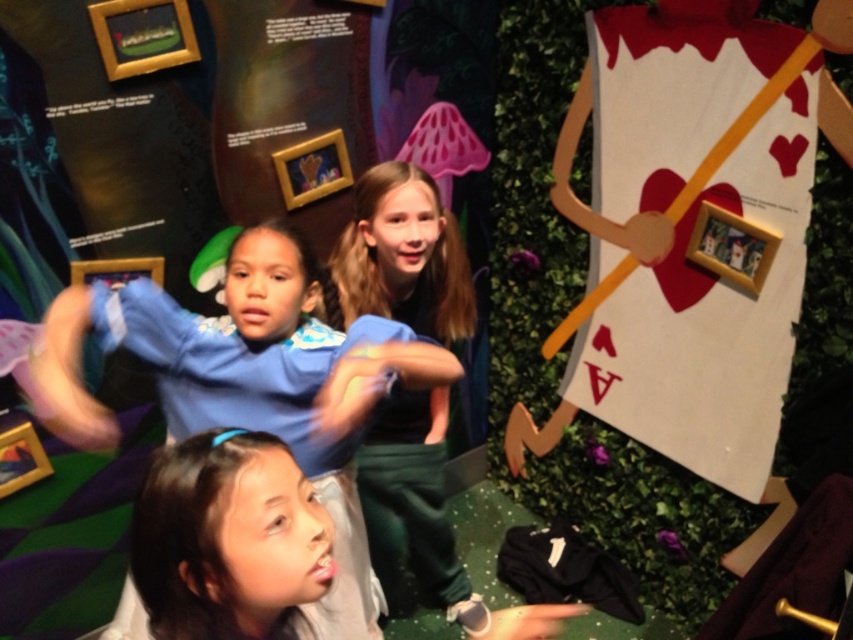
You are a child trying to reach the white cardboard heart at right from the blue fleece jacket at center. Can you stretch your arms to reach it without moving your feet?

The distance between the white cardboard heart at right and the blue fleece jacket at center is 4.04 feet. Since an average child can stretch their arms about 3 feet, you would not be able to reach the white cardboard heart at right without moving your feet.

You are a photographer positioned at the center of the room. You want to take a photo of the gold wooden picture frame at upper left without moving the blue denim jeans at center. Is the distance between them sufficient for you to focus on the frame while keeping the jeans in the background?

The distance between blue denim jeans at center and gold wooden picture frame at upper left is 35.38 inches, which should be sufficient for a photographer to focus on the frame while keeping the jeans in the background as long as the camera settings allow for a shallow depth of field or the subject distance is properly adjusted.